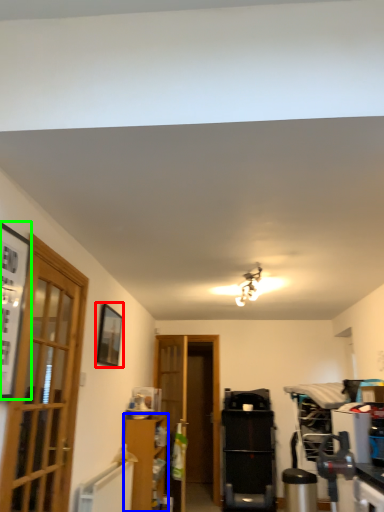
Question: Which is nearer to the picture frame (highlighted by a red box)? cabinetry (highlighted by a blue box) or picture frame (highlighted by a green box).

Choices:
 (A) cabinetry
 (B) picture frame

Answer: (A)